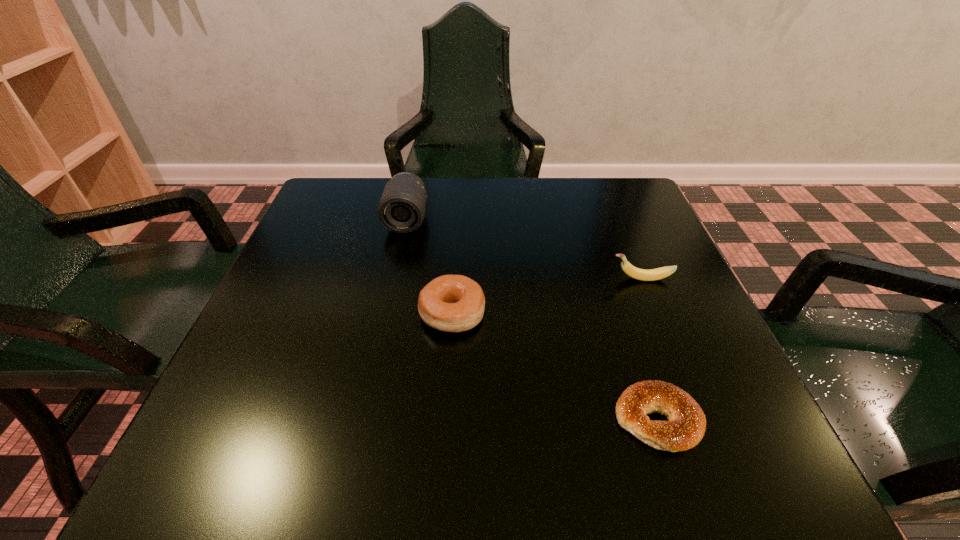
Find the location of a particular element. The image size is (960, 540). free space at the left edge of the desktop is located at coordinates (303, 283).

Find the location of a particular element. The width and height of the screenshot is (960, 540). vacant region at the right edge of the desktop is located at coordinates (696, 299).

Image resolution: width=960 pixels, height=540 pixels. In the image, there is a desktop. In order to click on free space at the far left corner in this screenshot , I will do `click(325, 222)`.

The width and height of the screenshot is (960, 540). In order to click on free space at the far right corner in this screenshot , I will do `click(629, 226)`.

In the image, there is a desktop. Identify the location of vacant space at the near right corner. This screenshot has height=540, width=960. (703, 477).

Identify the location of unoccupied position between the leftmost object and the nearest object. This screenshot has height=540, width=960. (532, 319).

At what (x,y) coordinates should I click in order to perform the action: click on vacant area that lies between the tallest object and the banana. Please return your answer as a coordinate pair (x, y). This screenshot has height=540, width=960. Looking at the image, I should click on (524, 249).

This screenshot has width=960, height=540. What are the coordinates of `free space that is in between the banana and the second nearest object` in the screenshot? It's located at (546, 296).

Where is `vacant area between the nearest object and the banana`? Image resolution: width=960 pixels, height=540 pixels. vacant area between the nearest object and the banana is located at coordinates (649, 349).

This screenshot has width=960, height=540. What are the coordinates of `free space between the left bagel and the nearer bagel` in the screenshot? It's located at (555, 367).